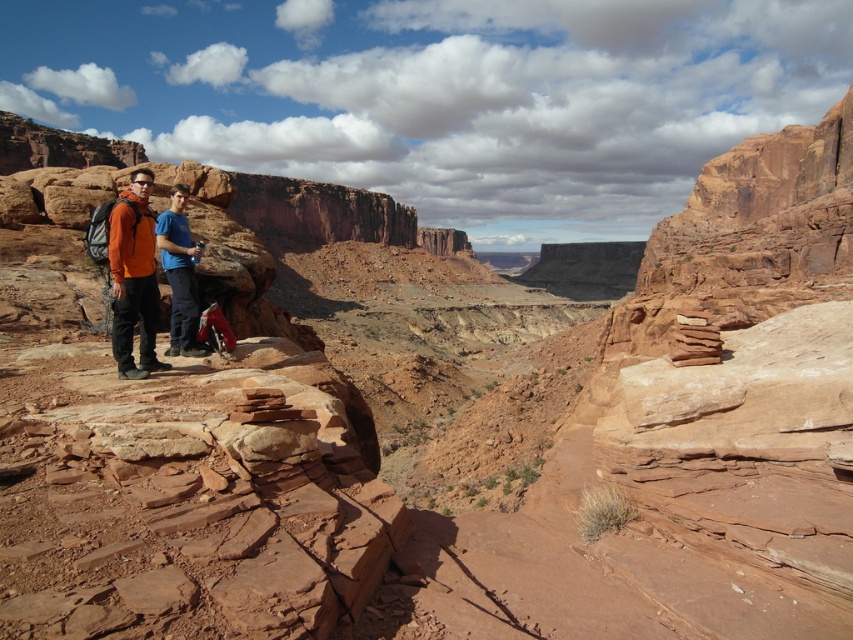
From the picture: You are planning to take a photo of the desert landscape with the two people in the scene. To ensure both the matte orange jacket at left and the blue cotton shirt at center are clearly visible in the frame, which person should be closer to the camera?

The matte orange jacket at left is positioned over the blue cotton shirt at center, so the person in the matte orange jacket at left is closer to the camera and will be more visible.

You are hiking in the desert and see two hikers wearing a matte orange jacket at left and a blue cotton shirt at center. Which hiker is positioned more to the left?

The matte orange jacket at left is positioned more to the left than the blue cotton shirt at center.

You are planning to take a photo of the desert landscape with the two people in the scene. To ensure both the matte orange jacket at left and the blue cotton shirt at center are clearly visible, which one should you focus on first considering their sizes?

The matte orange jacket at left is wider than the blue cotton shirt at center, so focusing on the matte orange jacket at left first would ensure both are visible since it is larger.